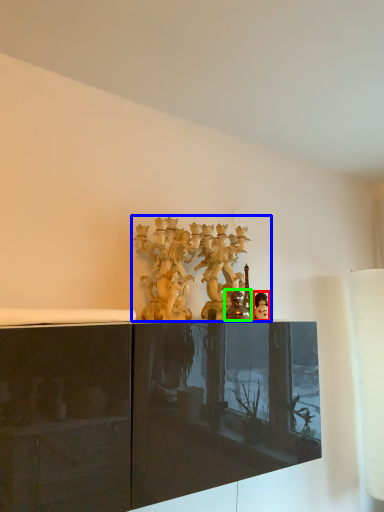
Question: Which is farther away from person (highlighted by a red box)? collection (highlighted by a blue box) or figurine (highlighted by a green box)?

Choices:
 (A) collection
 (B) figurine

Answer: (A)